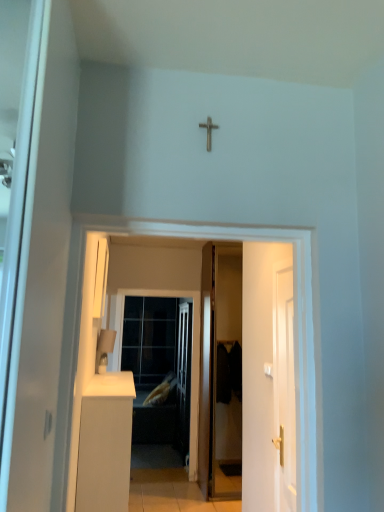
Question: Should I look upward or downward to see matte white lampshade at lower left?

Choices:
 (A) down
 (B) up

Answer: (A)

Question: Is white glossy door at right, the second door positioned from the back, at the left side of clear glass screen door at center?

Choices:
 (A) yes
 (B) no

Answer: (B)

Question: Does white glossy door at right, the first door in the front-to-back sequence, appear on the right side of clear glass screen door at center?

Choices:
 (A) no
 (B) yes

Answer: (B)

Question: From the image's perspective, does white glossy door at right, the second door positioned from the back, appear lower than clear glass screen door at center?

Choices:
 (A) yes
 (B) no

Answer: (B)

Question: Is white glossy door at right, the first door in the front-to-back sequence, bigger than clear glass screen door at center?

Choices:
 (A) yes
 (B) no

Answer: (B)

Question: Could you tell me if white glossy door at right, which ranks as the first door in right-to-left order, is facing clear glass screen door at center?

Choices:
 (A) no
 (B) yes

Answer: (A)

Question: Is white glossy door at right, the first door in the front-to-back sequence, completely or partially outside of clear glass screen door at center?

Choices:
 (A) yes
 (B) no

Answer: (A)

Question: From the image's perspective, is white matte cabinet at lower left below clear glass screen door at center?

Choices:
 (A) no
 (B) yes

Answer: (B)

Question: Considering the relative positions of white matte cabinet at lower left and clear glass screen door at center in the image provided, is white matte cabinet at lower left to the right of clear glass screen door at center from the viewer's perspective?

Choices:
 (A) yes
 (B) no

Answer: (B)

Question: Does white matte cabinet at lower left appear on the left side of clear glass screen door at center?

Choices:
 (A) yes
 (B) no

Answer: (A)

Question: Is the depth of white matte cabinet at lower left greater than that of clear glass screen door at center?

Choices:
 (A) no
 (B) yes

Answer: (A)

Question: Considering the relative sizes of white matte cabinet at lower left and clear glass screen door at center in the image provided, is white matte cabinet at lower left smaller than clear glass screen door at center?

Choices:
 (A) no
 (B) yes

Answer: (A)

Question: From a real-world perspective, does white matte cabinet at lower left sit lower than clear glass screen door at center?

Choices:
 (A) no
 (B) yes

Answer: (B)

Question: Considering the relative sizes of metallic cross at upper center and white glossy door at right, the first door in the front-to-back sequence, in the image provided, is metallic cross at upper center smaller than white glossy door at right, the first door in the front-to-back sequence,?

Choices:
 (A) yes
 (B) no

Answer: (A)